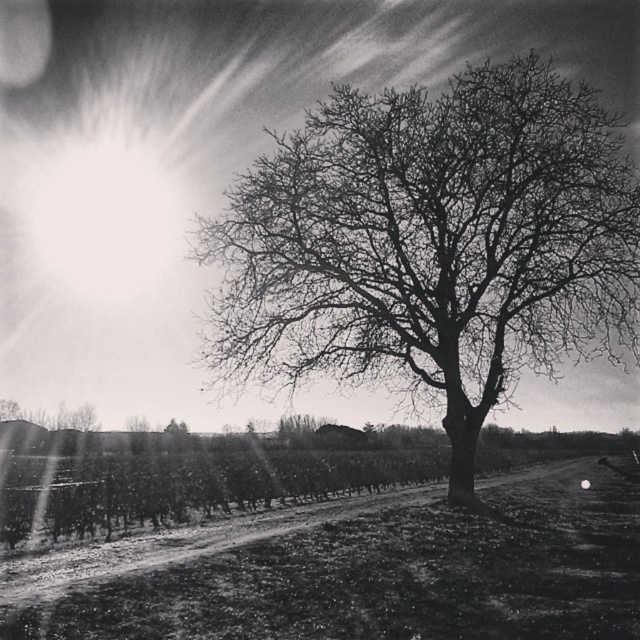
Can you confirm if bare branches at center is thinner than dirt ground at center?

Yes.

Is point (301, 300) closer to camera compared to point (568, 470)?

Yes, point (301, 300) is closer to viewer.

Who is more distant from viewer, (243,374) or (600,490)?

The point (600,490) is behind.

Find the location of a particular element. This screenshot has width=640, height=640. bare branches at center is located at coordinates (433, 244).